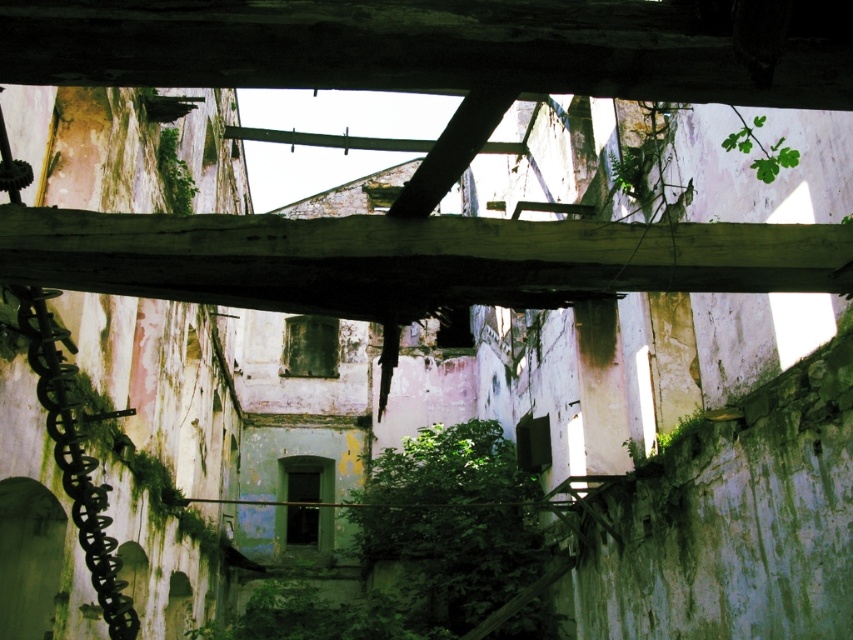
Is green wood beam at center above green leafy plant at center?

Incorrect, green wood beam at center is not positioned above green leafy plant at center.

Does green wood beam at center come behind green leafy plant at center?

That is False.

The height and width of the screenshot is (640, 853). I want to click on green wood beam at center, so click(408, 259).

This screenshot has width=853, height=640. Find the location of `green wood beam at center`. green wood beam at center is located at coordinates (408, 259).

Who is more forward, [39,266] or [383,548]?

Point [39,266] is more forward.

Is point (38, 248) positioned in front of point (393, 515)?

Yes, point (38, 248) is in front of point (393, 515).

You are a GUI agent. You are given a task and a screenshot of the screen. Output one action in this format:
    pyautogui.click(x=<x>, y=<y>)
    Task: Click on the green wood beam at center
    
    Given the screenshot: What is the action you would take?
    pyautogui.click(x=408, y=259)

Is green leafy bush at center positioned at the back of green leafy plant at center?

Yes, green leafy bush at center is further from the viewer.

Between point (556, 627) and point (187, 189), which one is positioned in front?

Point (187, 189)

Image resolution: width=853 pixels, height=640 pixels. I want to click on green leafy bush at center, so click(451, 524).